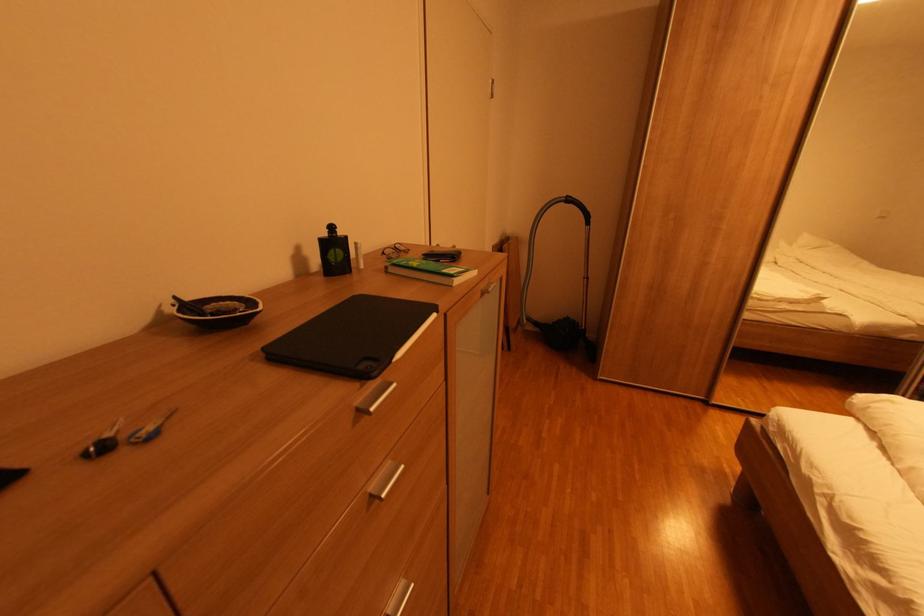
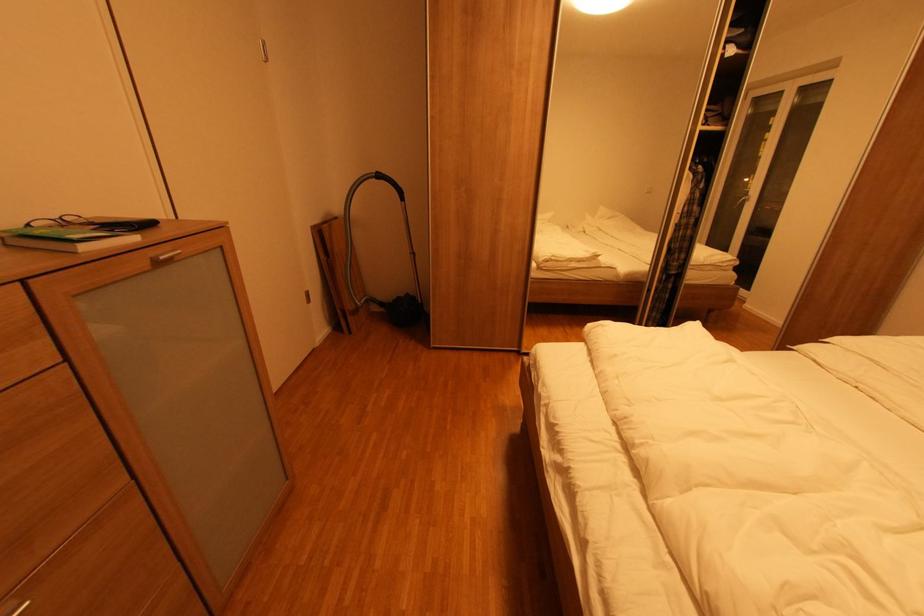
Find the pixel in the second image that matches the point at 577,206 in the first image.

(387, 182)